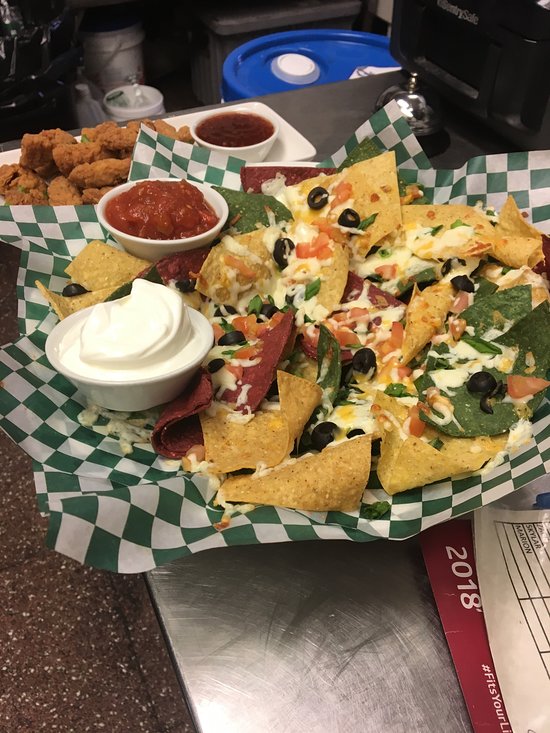
The width and height of the screenshot is (550, 733). I want to click on granite kitchen countertop, so click(72, 618).